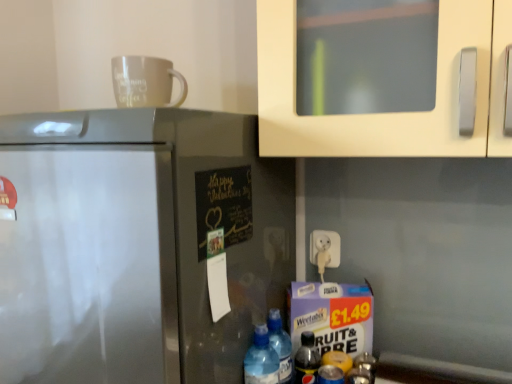
Question: From the image's perspective, is translucent plastic bottle at lower right, marked as the 4th bottle in a left-to-right arrangement, above or below chalkboard paper at center?

Choices:
 (A) above
 (B) below

Answer: (B)

Question: From a real-world perspective, is translucent plastic bottle at lower right, marked as the 4th bottle in a left-to-right arrangement, above or below chalkboard paper at center?

Choices:
 (A) below
 (B) above

Answer: (A)

Question: Which object is the farthest from the translucent plastic bottles at lower center, the 2th bottle positioned from the left?

Choices:
 (A) translucent plastic bottle at lower right, marked as the 4th bottle in a left-to-right arrangement
 (B) satin silver refrigerator at left
 (C) translucent plastic bottles at lower center, which ranks as the first bottle in left-to-right order
 (D) matte white mug at upper center
 (E) chalkboard paper at center

Answer: (D)

Question: Which object is the farthest from the translucent plastic bottles at lower center, the 2th bottle positioned from the left?

Choices:
 (A) translucent plastic bottles at lower center, which ranks as the first bottle in left-to-right order
 (B) white plastic plug at lower center
 (C) matte white mug at upper center
 (D) chalkboard paper at center
 (E) satin silver refrigerator at left

Answer: (C)